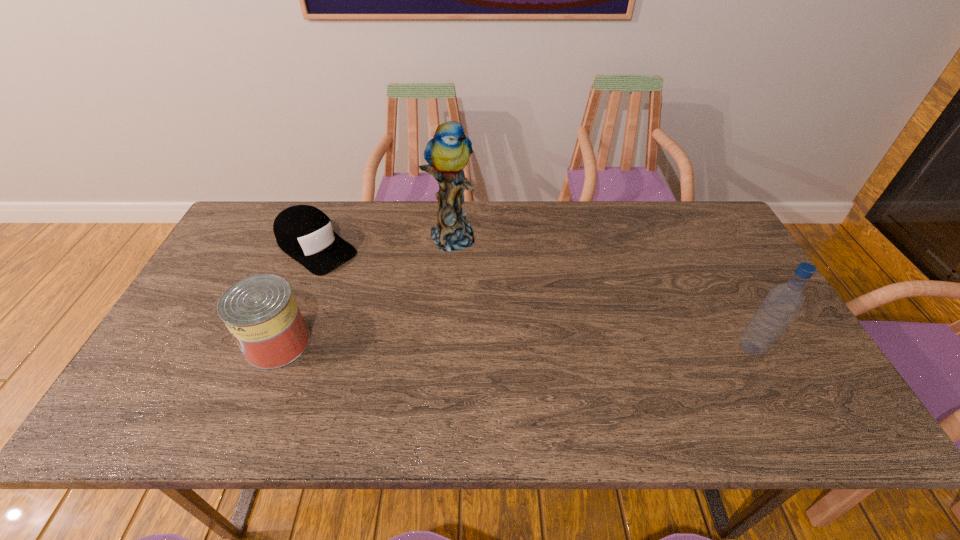
Find the location of a particular element. The width and height of the screenshot is (960, 540). free spot on the desktop that is between the third tallest object and the rightmost object and is positioned on the face of the tallest object is located at coordinates (534, 346).

Locate an element on the screen. The height and width of the screenshot is (540, 960). vacant spot on the desktop that is between the third tallest object and the water bottle and is positioned on the front-facing side of the shortest object is located at coordinates (446, 345).